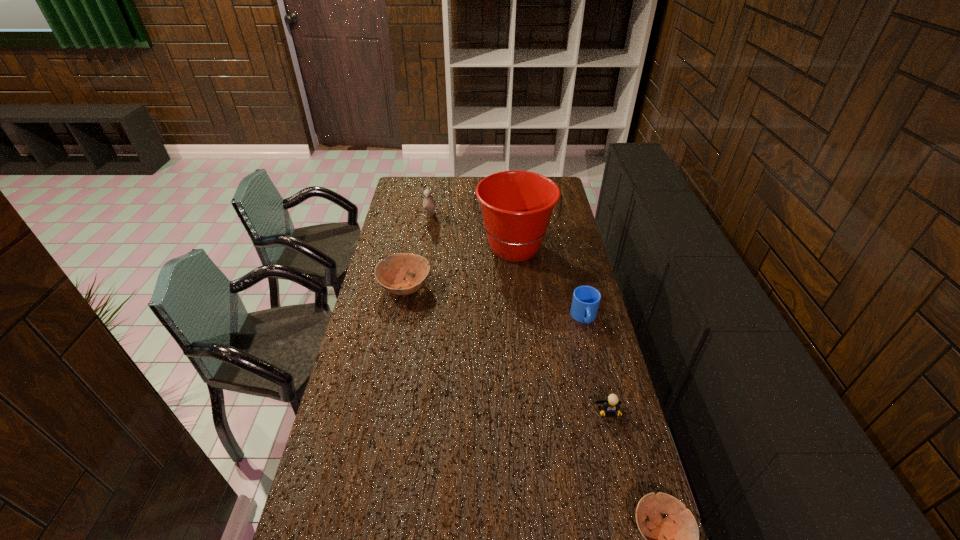
Please mark a free spot for a new bowl to balance the arrangement. Please provide its 2D coordinates. Your answer should be formatted as a tuple, i.e. [(x, y)], where the tuple contains the x and y coordinates of a point satisfying the conditions above.

[(502, 381)]